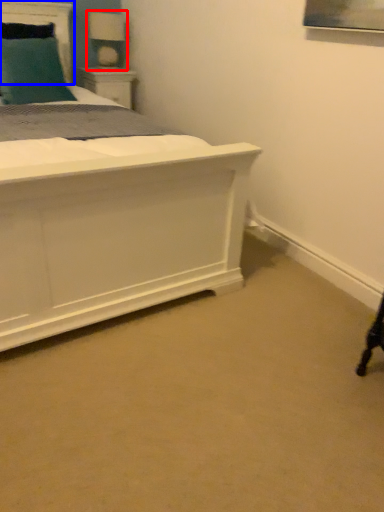
Question: Among these objects, which one is nearest to the camera, table lamp (highlighted by a red box) or headboard (highlighted by a blue box)?

Choices:
 (A) table lamp
 (B) headboard

Answer: (B)